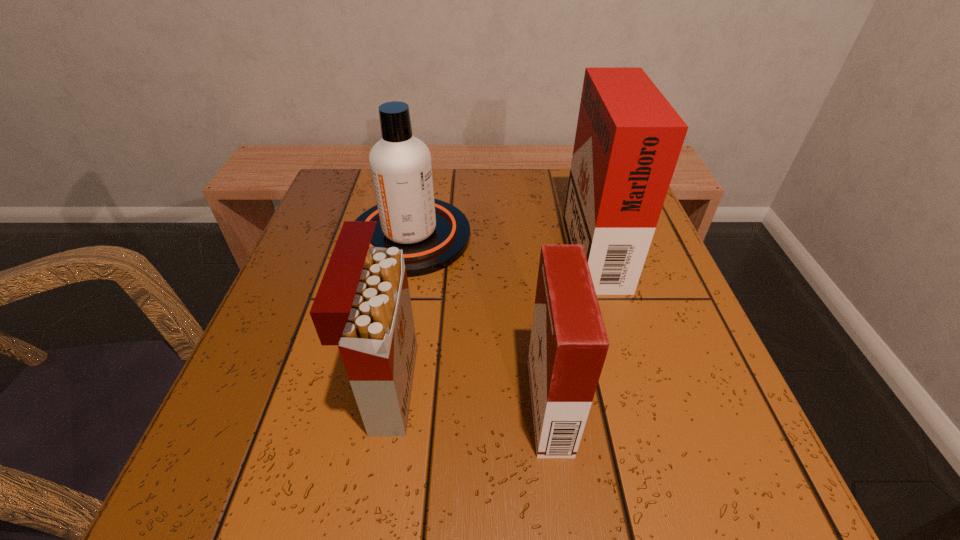
Identify the location of the rightmost object. The image size is (960, 540). (628, 139).

Where is `the rightmost cigarette_case`? the rightmost cigarette_case is located at coordinates (628, 139).

You are a GUI agent. You are given a task and a screenshot of the screen. Output one action in this format:
    pyautogui.click(x=<x>, y=<y>)
    Task: Click on the cleansing agent
    The width and height of the screenshot is (960, 540).
    Given the screenshot: What is the action you would take?
    pyautogui.click(x=433, y=234)

The image size is (960, 540). What are the coordinates of `the leftmost cigarette_case` in the screenshot? It's located at (363, 305).

Locate an element on the screen. the second object from right to left is located at coordinates (568, 346).

Locate an element on the screen. This screenshot has width=960, height=540. free point located 0.320m on the front-facing side of the rightmost object is located at coordinates (418, 243).

The image size is (960, 540). I want to click on free space located on the front-facing side of the rightmost object, so click(380, 243).

The image size is (960, 540). In order to click on free space located on the front-facing side of the rightmost object in this screenshot , I will do `click(521, 243)`.

Identify the location of vacant space located on the right of the cleansing agent. (637, 237).

Identify the location of free space located 0.260m with the lid open on the leftmost cigarette_case. Image resolution: width=960 pixels, height=540 pixels. (582, 388).